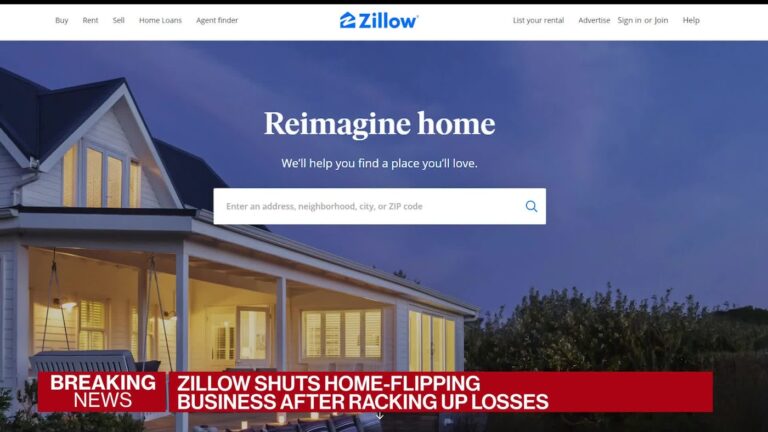
Locate an element on the screen. The image size is (768, 432). second level windows is located at coordinates (93, 183), (65, 177), (114, 173), (137, 173).